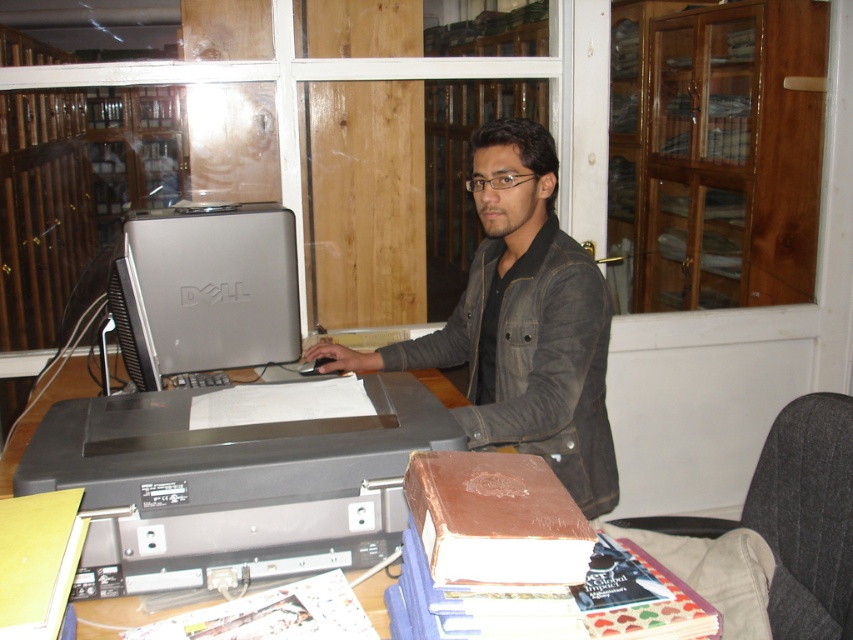
Question: Which of the following is the closest to the observer?

Choices:
 (A) (805, 440)
 (B) (529, 228)
 (C) (230, 483)
 (D) (148, 240)

Answer: (C)

Question: Which of the following is the closest to the observer?

Choices:
 (A) dark brown leather jacket at center
 (B) silver metallic computer at center

Answer: (A)

Question: From the image, what is the correct spatial relationship of dark brown leather jacket at center in relation to silver metallic computer at center?

Choices:
 (A) left
 (B) right

Answer: (B)

Question: In this image, where is black plastic printer at center located relative to dark gray fabric chair at lower right?

Choices:
 (A) left
 (B) right

Answer: (A)

Question: Which point is farther from the camera taking this photo?

Choices:
 (A) (248, 337)
 (B) (810, 589)
 (C) (467, 355)
 (D) (114, 493)

Answer: (C)

Question: Can you confirm if black plastic printer at center is wider than dark brown leather jacket at center?

Choices:
 (A) no
 (B) yes

Answer: (A)